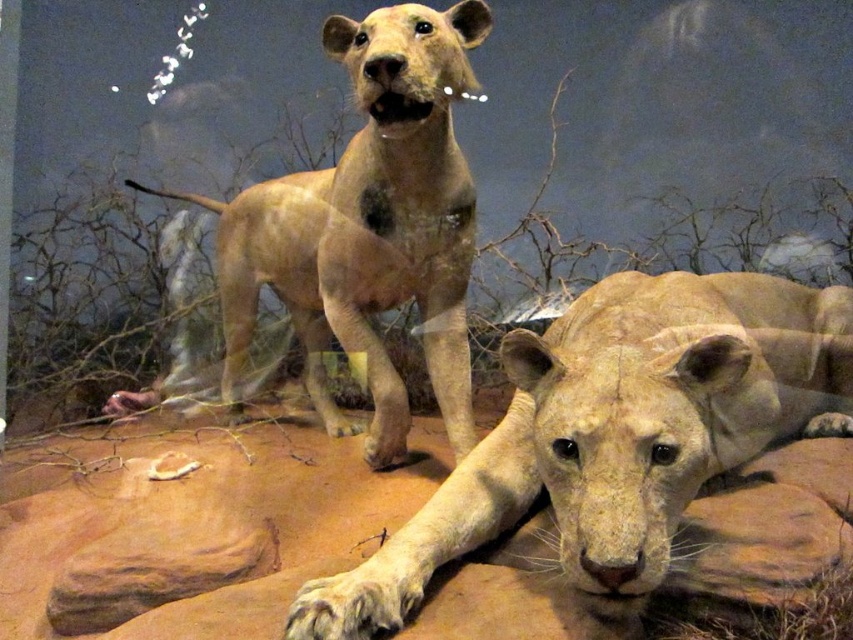
Is point (805, 320) less distant than point (332, 234)?

No.

The height and width of the screenshot is (640, 853). Describe the element at coordinates (616, 433) in the screenshot. I see `light beige fur at center` at that location.

What are the coordinates of `light beige fur at center` in the screenshot? It's located at (616, 433).